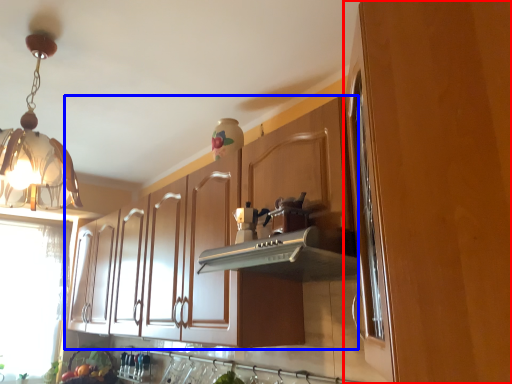
Question: Among these objects, which one is nearest to the camera, cabinetry (highlighted by a red box) or cabinetry (highlighted by a blue box)?

Choices:
 (A) cabinetry
 (B) cabinetry

Answer: (A)